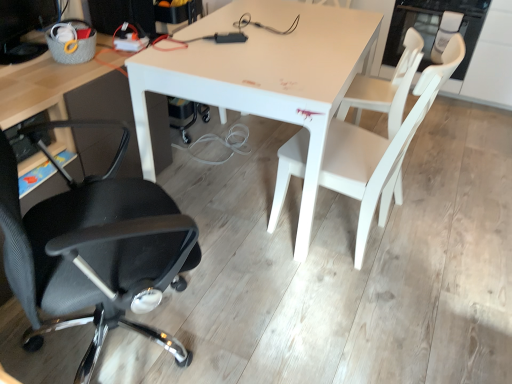
The width and height of the screenshot is (512, 384). I want to click on vacant space in front of white matte chair at center, the 2th chair in the left-to-right sequence, so click(x=349, y=306).